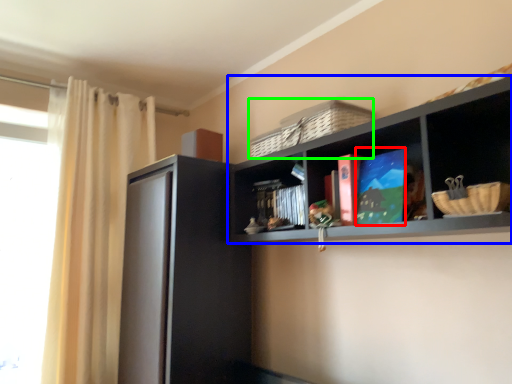
Question: Which object is the closest to the book (highlighted by a red box)? Choose among these: shelf (highlighted by a blue box) or basket (highlighted by a green box).

Choices:
 (A) shelf
 (B) basket

Answer: (A)